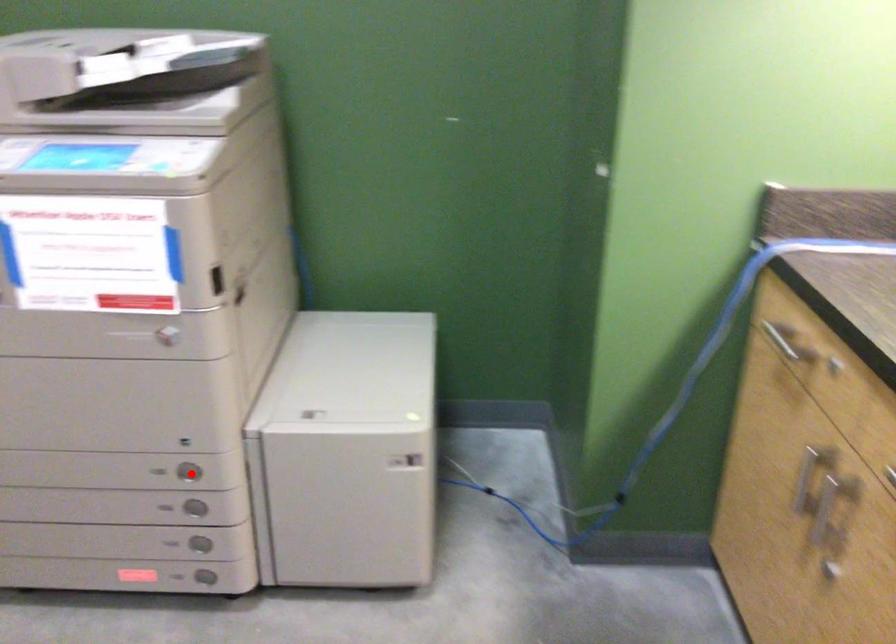
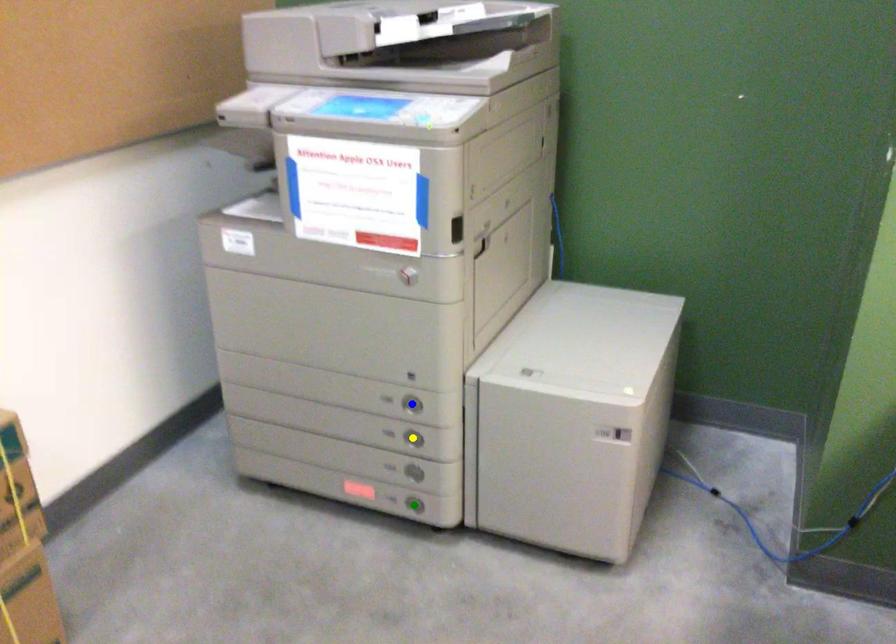
Question: I am providing you with two images of the same scene from different viewpoints. A red point is marked on the first image. You are given multiple points on the second image. Which point in image 2 represents the same 3d spot as the red point in image 1?

Choices:
 (A) yellow point
 (B) blue point
 (C) green point

Answer: (B)